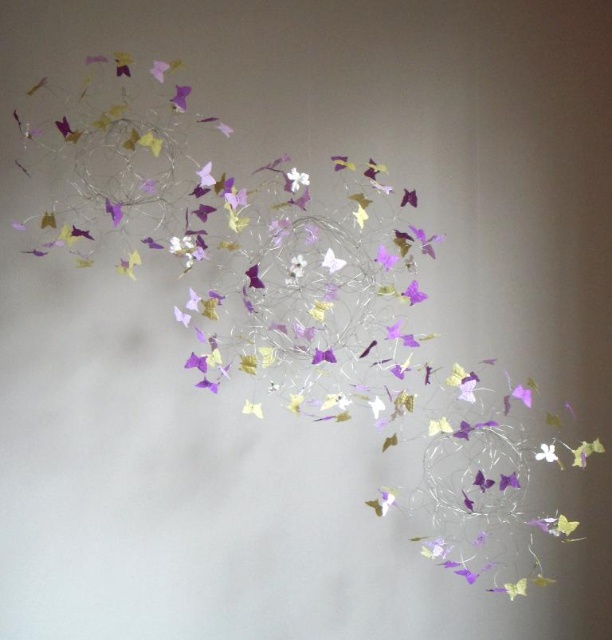
You are an art installer setting up a decorative hanging piece. You need to adjust the positions of two points marked on the design. The first point is at coordinates point (296, 172) and the second at point (539, 451). Which point is closer to the camera?

Point (296, 172) is closer to the camera than point (539, 451).

You are an interior designer planning to hang the decorative piece in a small room. You want to ensure that the purple paper flower at upper left and the purple paper butterfly at center won not overwhelm the space. Which object takes up more space and should be considered for placement adjustments?

The purple paper butterfly at center occupies more space than the purple paper flower at upper left, so it should be considered for placement adjustments to avoid overwhelming the small room.

You are a photographer trying to capture the purple paper flower at upper left in the center of your camera frame. Given the flower is at coordinate point 0.153, 0.294, what adjustment should you make to your camera position to center it?

To center the purple paper flower at upper left, adjust the camera position so that the flower moves from its current coordinates at point (179, 97) to the center point of the frame.